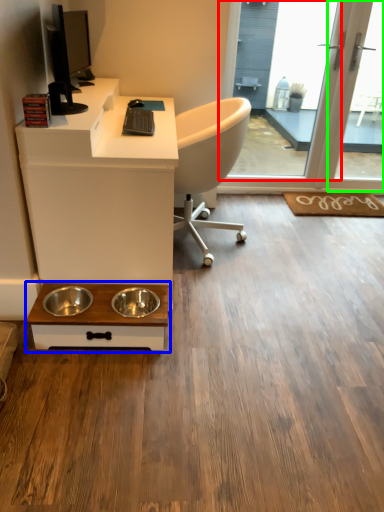
Question: Which is nearer to the screen door (highlighted by a red box)? table (highlighted by a blue box) or screen door (highlighted by a green box).

Choices:
 (A) table
 (B) screen door

Answer: (B)